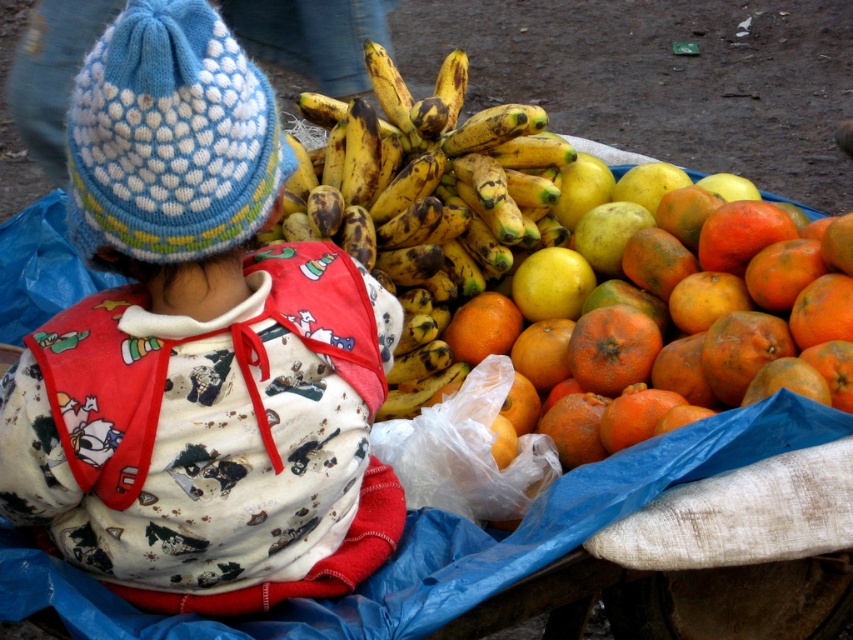
Question: Which of these objects is positioned closest to the knitted wool hat at upper left?

Choices:
 (A) yellowish-brown textured bananas at center
 (B) ripe orange at center

Answer: (B)

Question: Does knitted wool hat at upper left come behind orange matte at center?

Choices:
 (A) yes
 (B) no

Answer: (B)

Question: Does knitted wool hat at upper left have a larger size compared to ripe orange at center?

Choices:
 (A) no
 (B) yes

Answer: (B)

Question: Can you confirm if orange matte citrus at right is positioned below ripe orange at center?

Choices:
 (A) yes
 (B) no

Answer: (B)

Question: Estimate the real-world distances between objects in this image. Which object is farther from the yellowish-brown textured bananas at center?

Choices:
 (A) ripe orange at center
 (B) orange matte at center
 (C) orange matte citrus at right
 (D) knitted wool hat at upper left

Answer: (D)

Question: Which of these objects is positioned farthest from the orange matte citrus at right?

Choices:
 (A) ripe orange at center
 (B) orange matte at center
 (C) yellowish-brown textured bananas at center
 (D) knitted wool hat at upper left

Answer: (D)